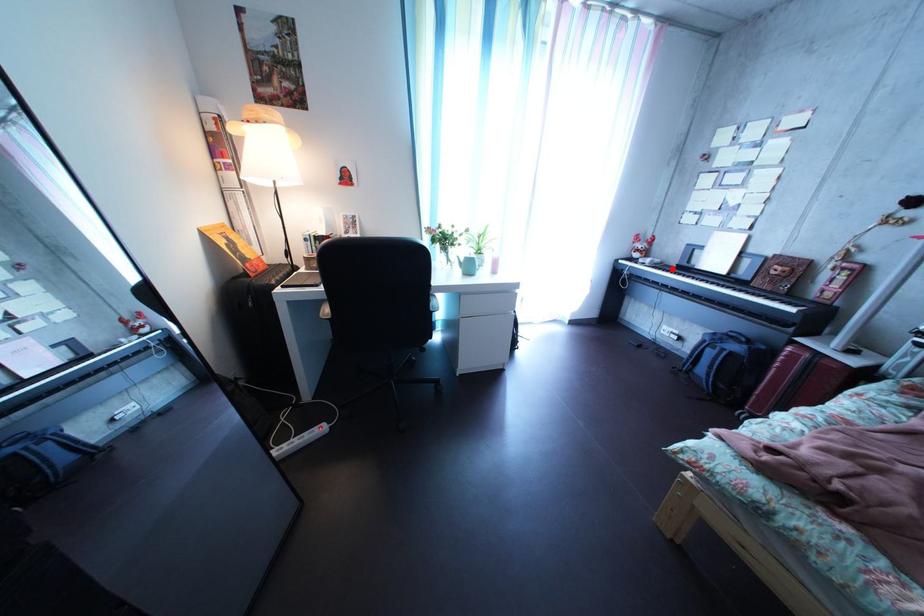
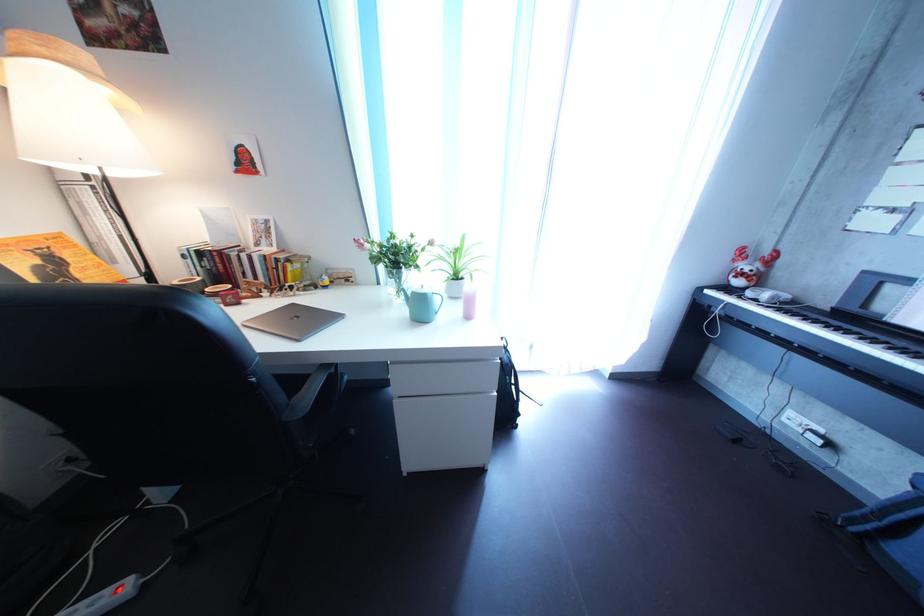
Locate, in the second image, the point that corresponds to the highlighted location in the first image.

(801, 304)